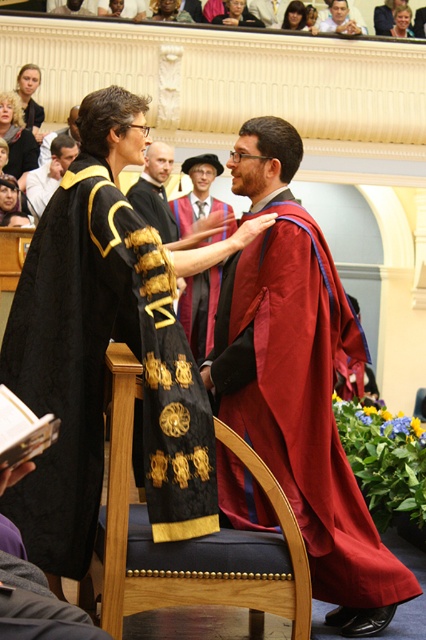
Is point (92, 237) positioned before point (253, 586)?

That is False.

Can you confirm if velvet black gown at center is smaller than black wood chair at center?

No.

Which is in front, point (63, 403) or point (127, 524)?

Point (127, 524) is more forward.

This screenshot has height=640, width=426. Identify the location of velvet black gown at center. (103, 372).

Describe the element at coordinates (299, 397) in the screenshot. I see `maroon velvet gown at center` at that location.

Identify the location of maroon velvet gown at center. (299, 397).

The image size is (426, 640). I want to click on maroon velvet gown at center, so click(x=299, y=397).

Who is lower down, maroon velvet gown at center or smooth brown hair at upper center?

maroon velvet gown at center is below.

Is point (224, 332) positioned after point (258, 12)?

No, it is in front of (258, 12).

Find the location of a particular element. This screenshot has height=640, width=426. maroon velvet gown at center is located at coordinates (299, 397).